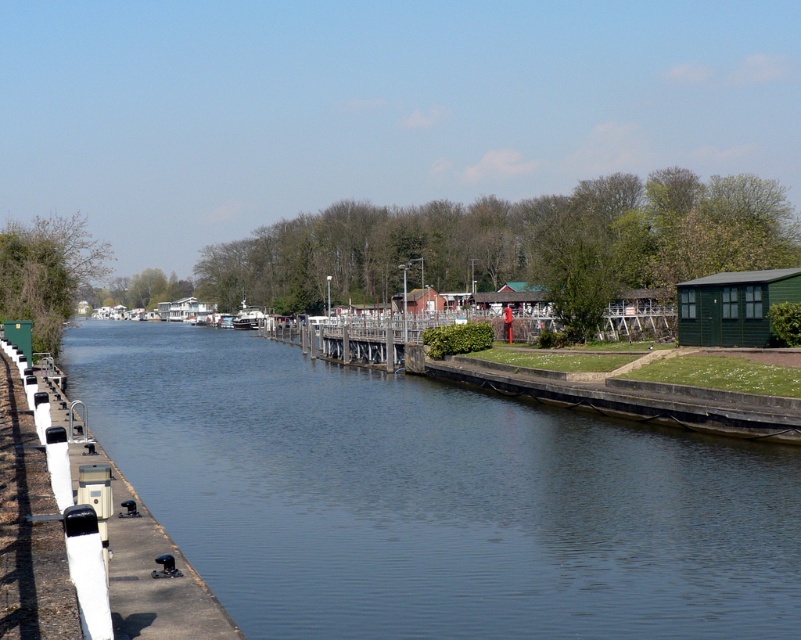
Question: Among these points, which one is nearest to the camera?

Choices:
 (A) (7, 577)
 (B) (239, 323)
 (C) (616, 529)

Answer: (A)

Question: Is smooth concrete river at center below white concrete dock at lower left?

Choices:
 (A) no
 (B) yes

Answer: (B)

Question: Does smooth concrete river at center have a lesser width compared to metallic gray boat at center?

Choices:
 (A) yes
 (B) no

Answer: (B)

Question: Which object is closer to the camera taking this photo?

Choices:
 (A) smooth concrete river at center
 (B) metallic gray boat at center

Answer: (A)

Question: Which point is closer to the camera?

Choices:
 (A) smooth concrete river at center
 (B) white concrete dock at lower left

Answer: (B)

Question: Is smooth concrete river at center closer to camera compared to white concrete dock at lower left?

Choices:
 (A) no
 (B) yes

Answer: (A)